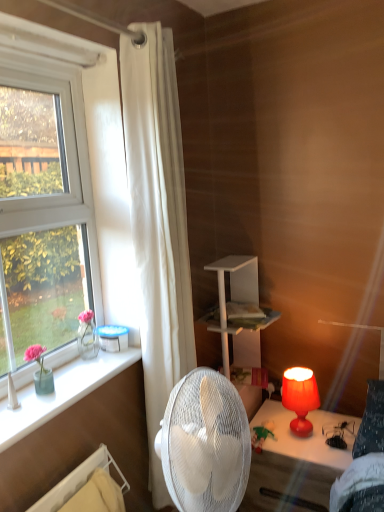
This screenshot has width=384, height=512. Identify the location of empty space that is ontop of white fabric curtain at left (from a real-world perspective). (144, 21).